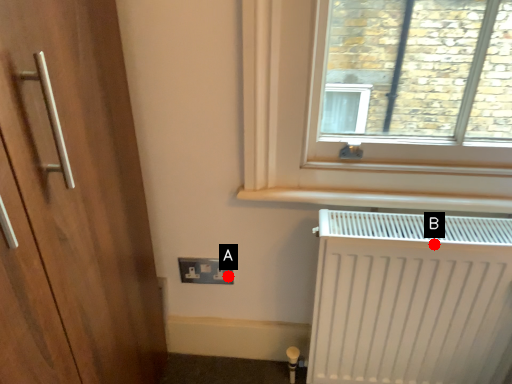
Question: Two points are circled on the image, labeled by A and B beside each circle. Which point is further to the camera?

Choices:
 (A) A is further
 (B) B is further

Answer: (A)